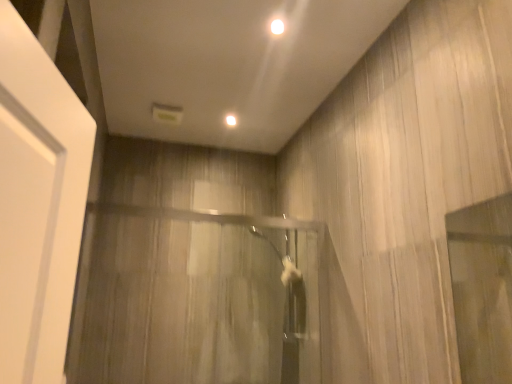
Question: Which direction should I rotate to look at white glossy light at upper center, marked as the second lighting in a bottom-to-top arrangement?

Choices:
 (A) left
 (B) right

Answer: (B)

Question: Considering the relative sizes of white glossy light at upper center, marked as the second lighting in a bottom-to-top arrangement, and white glossy light at upper center, the second lighting positioned from the top, in the image provided, is white glossy light at upper center, marked as the second lighting in a bottom-to-top arrangement, shorter than white glossy light at upper center, the second lighting positioned from the top,?

Choices:
 (A) no
 (B) yes

Answer: (B)

Question: Can you confirm if white glossy light at upper center, the 1th lighting when ordered from right to left, is positioned to the right of white glossy light at upper center, which ranks as the first lighting in left-to-right order?

Choices:
 (A) no
 (B) yes

Answer: (B)

Question: Considering the relative sizes of white glossy light at upper center, which is the 1th lighting in front-to-back order, and white glossy light at upper center, marked as the 2th lighting in a front-to-back arrangement, in the image provided, is white glossy light at upper center, which is the 1th lighting in front-to-back order, thinner than white glossy light at upper center, marked as the 2th lighting in a front-to-back arrangement,?

Choices:
 (A) yes
 (B) no

Answer: (B)

Question: Could white glossy light at upper center, which appears as the first lighting when viewed from the back, be considered to be inside white glossy light at upper center, the first lighting when ordered from top to bottom?

Choices:
 (A) no
 (B) yes

Answer: (A)

Question: Is white glossy light at upper center, the second lighting in the back-to-front sequence, taller than white glossy light at upper center, which ranks as the first lighting in left-to-right order?

Choices:
 (A) yes
 (B) no

Answer: (B)

Question: Is white glossy light at upper center, the first lighting when ordered from top to bottom, next to white glossy light at upper center, which ranks as the first lighting in left-to-right order, and touching it?

Choices:
 (A) yes
 (B) no

Answer: (B)

Question: Does clear glass shower door at center have a smaller size compared to white glossy light at upper center, which is the 1th lighting in front-to-back order?

Choices:
 (A) no
 (B) yes

Answer: (A)

Question: Is clear glass shower door at center positioned with its back to white glossy light at upper center, the second lighting in the back-to-front sequence?

Choices:
 (A) no
 (B) yes

Answer: (A)

Question: Does clear glass shower door at center have a lesser height compared to white glossy light at upper center, the 1th lighting when ordered from right to left?

Choices:
 (A) no
 (B) yes

Answer: (A)

Question: Does clear glass shower door at center come in front of white glossy light at upper center, which is the 1th lighting in front-to-back order?

Choices:
 (A) yes
 (B) no

Answer: (A)

Question: Does clear glass shower door at center appear on the right side of white glossy light at upper center, which is the 1th lighting in front-to-back order?

Choices:
 (A) no
 (B) yes

Answer: (A)

Question: Is clear glass shower door at center to the left of white glossy light at upper center, placed as the 2th lighting when sorted from left to right, from the viewer's perspective?

Choices:
 (A) yes
 (B) no

Answer: (A)

Question: Is the depth of white glossy light at upper center, the second lighting positioned from the top, less than that of clear glass shower door at center?

Choices:
 (A) no
 (B) yes

Answer: (A)